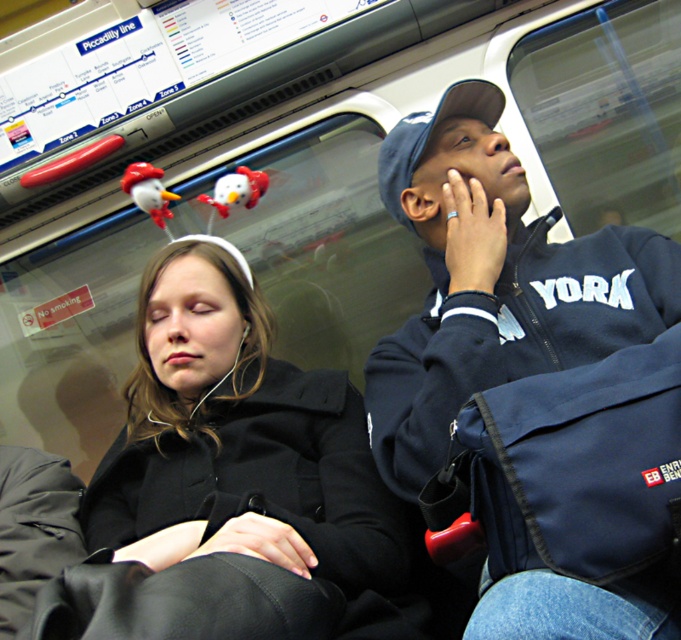
Does black matte coat at center appear over navy blue jacket at upper right?

Actually, black matte coat at center is below navy blue jacket at upper right.

Who is positioned more to the left, black matte coat at center or navy blue jacket at upper right?

Positioned to the left is black matte coat at center.

Describe the element at coordinates (244, 452) in the screenshot. I see `black matte coat at center` at that location.

Where is `black matte coat at center`? The width and height of the screenshot is (681, 640). black matte coat at center is located at coordinates (244, 452).